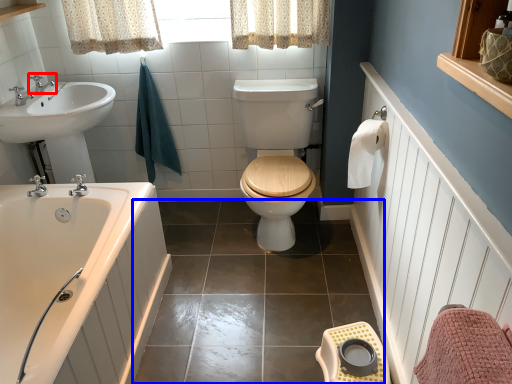
Question: Which object appears farthest to the camera in this image, tap (highlighted by a red box) or tile (highlighted by a blue box)?

Choices:
 (A) tap
 (B) tile

Answer: (A)